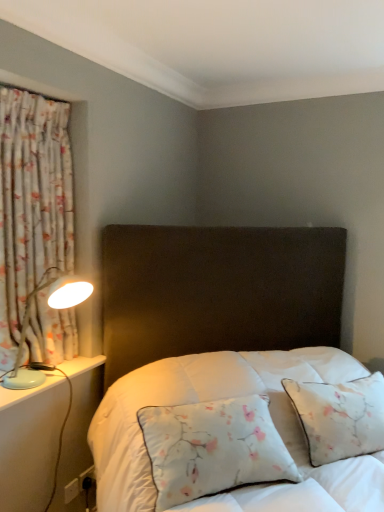
Question: From a real-world perspective, is floral fabric curtain at left beneath light blue plastic table lamp at left?

Choices:
 (A) no
 (B) yes

Answer: (A)

Question: Is floral fabric curtain at left not within light blue plastic table lamp at left?

Choices:
 (A) yes
 (B) no

Answer: (A)

Question: Does floral fabric curtain at left have a greater height compared to light blue plastic table lamp at left?

Choices:
 (A) yes
 (B) no

Answer: (A)

Question: Does floral fabric curtain at left lie behind light blue plastic table lamp at left?

Choices:
 (A) no
 (B) yes

Answer: (B)

Question: From a real-world perspective, is floral fabric curtain at left located higher than light blue plastic table lamp at left?

Choices:
 (A) no
 (B) yes

Answer: (B)

Question: Can you confirm if floral fabric curtain at left is shorter than light blue plastic table lamp at left?

Choices:
 (A) yes
 (B) no

Answer: (B)

Question: Is white plastic electric outlet at lower left bigger than floral fabric pillow at center?

Choices:
 (A) no
 (B) yes

Answer: (A)

Question: Could you tell me if white plastic electric outlet at lower left is turned towards floral fabric pillow at center?

Choices:
 (A) yes
 (B) no

Answer: (B)

Question: Is white plastic electric outlet at lower left closer to camera compared to floral fabric pillow at center?

Choices:
 (A) yes
 (B) no

Answer: (B)

Question: From a real-world perspective, is white plastic electric outlet at lower left located higher than floral fabric pillow at center?

Choices:
 (A) no
 (B) yes

Answer: (A)

Question: From the image's perspective, does white plastic electric outlet at lower left appear higher than floral fabric pillow at center?

Choices:
 (A) no
 (B) yes

Answer: (A)

Question: Would you say white plastic electric outlet at lower left is a long distance from floral fabric pillow at center?

Choices:
 (A) yes
 (B) no

Answer: (B)

Question: Is floral fabric curtain at left oriented away from floral fabric pillow at center?

Choices:
 (A) yes
 (B) no

Answer: (B)